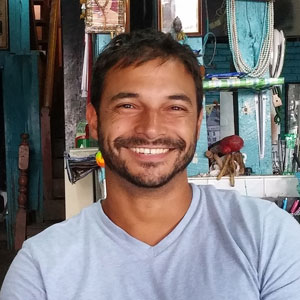
The height and width of the screenshot is (300, 300). What are the coordinates of `wall` in the screenshot? It's located at (224, 58), (28, 83).